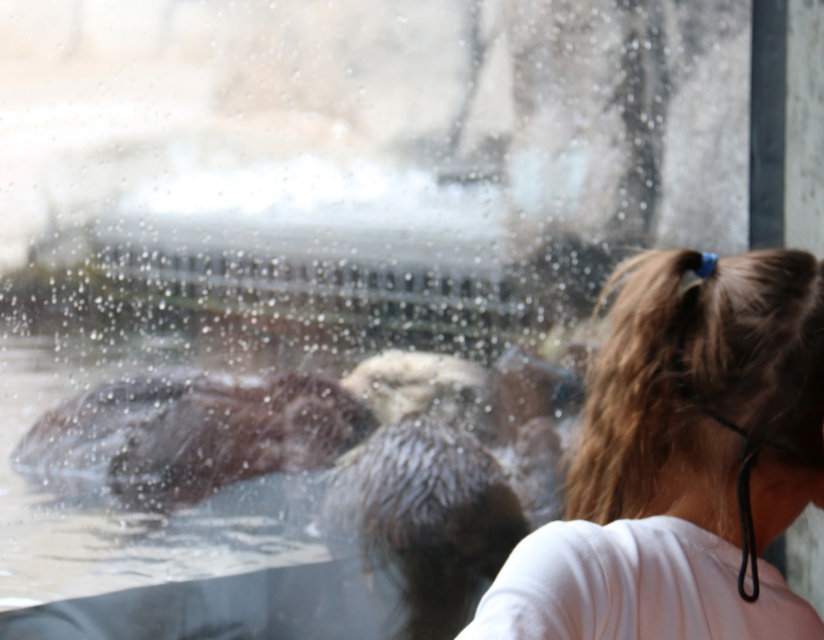
In the scene shown: You are a visitor at the aquarium and notice the blonde hair at upper right and the brown fuzzy otter at lower left through the wet glass window. Which object is located higher in the image?

The blonde hair at upper right is positioned over the brown fuzzy otter at lower left, so it is higher in the image.

You are a visitor at the aquarium and you see the blonde hair at upper right and the brown fuzzy otter at lower left through the wet window. Which object appears bigger in the image?

The blonde hair at upper right appears bigger in the image because it has a larger size compared to the brown fuzzy otter at lower left.

You are a zookeeper observing the otter enclosure through the wet window. You notice the blonde hair at upper right and the brown fuzzy otter at lower left. Which object is closer to you through the window?

The blonde hair at upper right is closer to you because it is in front of the brown fuzzy otter at lower left.